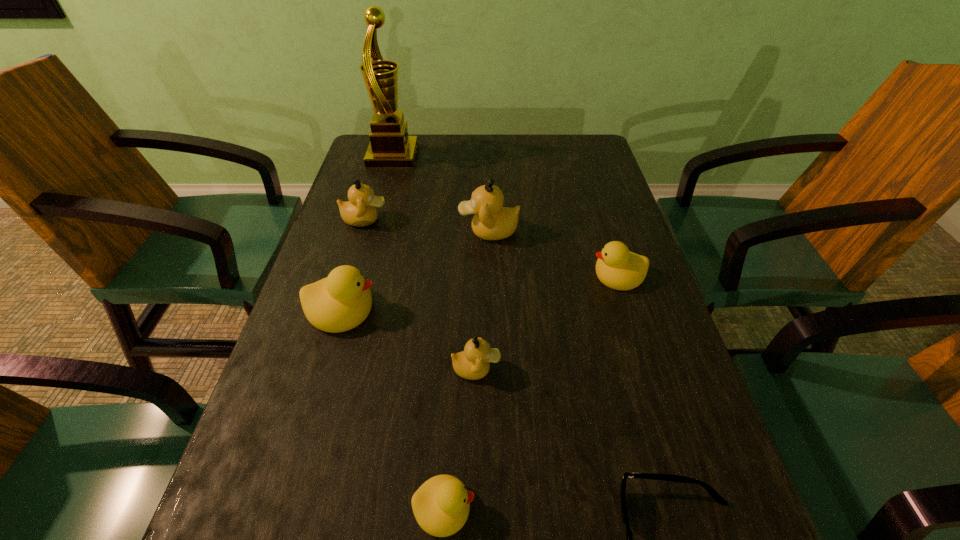
Identify the location of free space at the far left corner of the desktop. (368, 140).

Find the location of a particular element. The image size is (960, 540). vacant space at the far right corner of the desktop is located at coordinates (607, 174).

Identify the location of blank region between the award and the second biggest tan duckling. (379, 188).

Image resolution: width=960 pixels, height=540 pixels. Identify the location of vacant point located between the second shortest object and the nearest tan duckling. (460, 438).

What are the coordinates of `unoccupied area between the biggest yellow duckling and the rightmost duckling` in the screenshot? It's located at (480, 292).

Find the location of a particular element. The width and height of the screenshot is (960, 540). vacant region between the nearest duckling and the farthest object is located at coordinates (419, 332).

Identify the location of unoccupied area between the rightmost yellow duckling and the second biggest tan duckling. Image resolution: width=960 pixels, height=540 pixels. (492, 247).

Locate an element on the screen. object that can be found as the second closest to the rightmost yellow duckling is located at coordinates (473, 363).

Select which object is the sixth closest to the second smallest yellow duckling. Please provide its 2D coordinates. Your answer should be formatted as a tuple, i.e. [(x, y)], where the tuple contains the x and y coordinates of a point satisfying the conditions above.

[(360, 210)]

Find the location of a particular element. The image size is (960, 540). duckling that is the closest to the seventh tallest object is located at coordinates (473, 363).